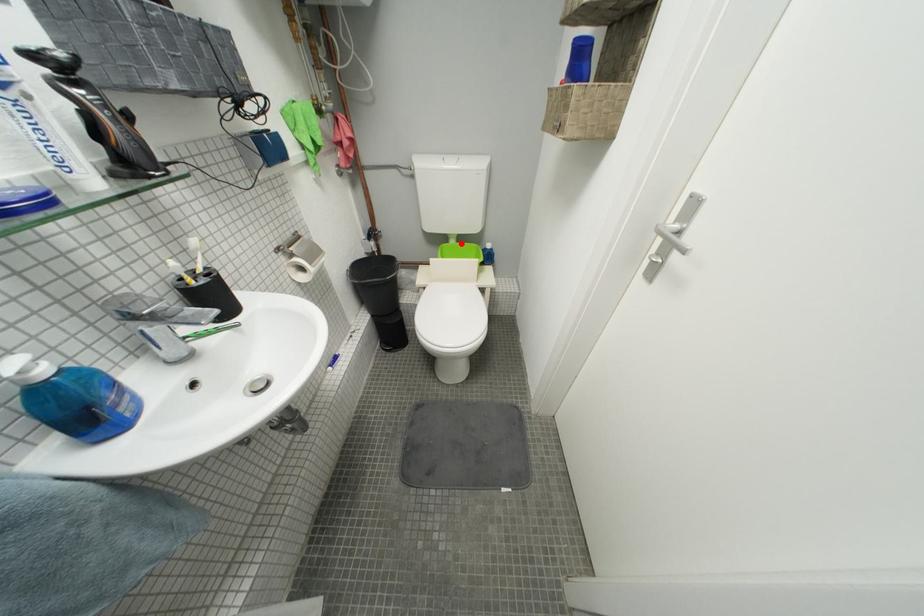
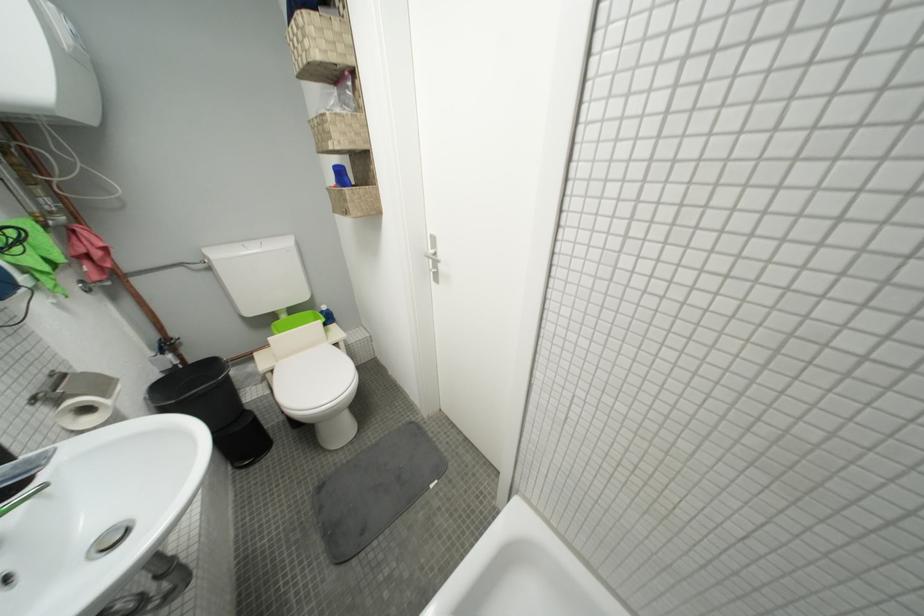
Where in the second image is the point corresponding to the highlighted location from the first image?

(293, 318)